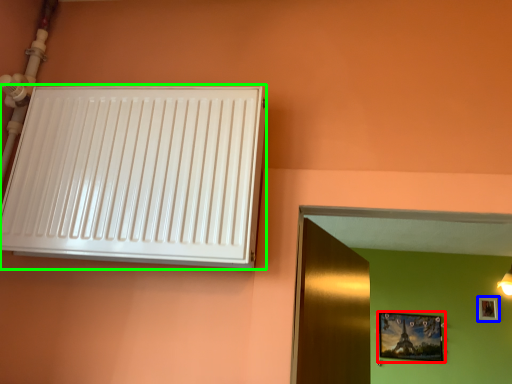
Question: Which is nearer to the picture frame (highlighted by a red box)? picture frame (highlighted by a blue box) or air conditioning (highlighted by a green box).

Choices:
 (A) picture frame
 (B) air conditioning

Answer: (A)